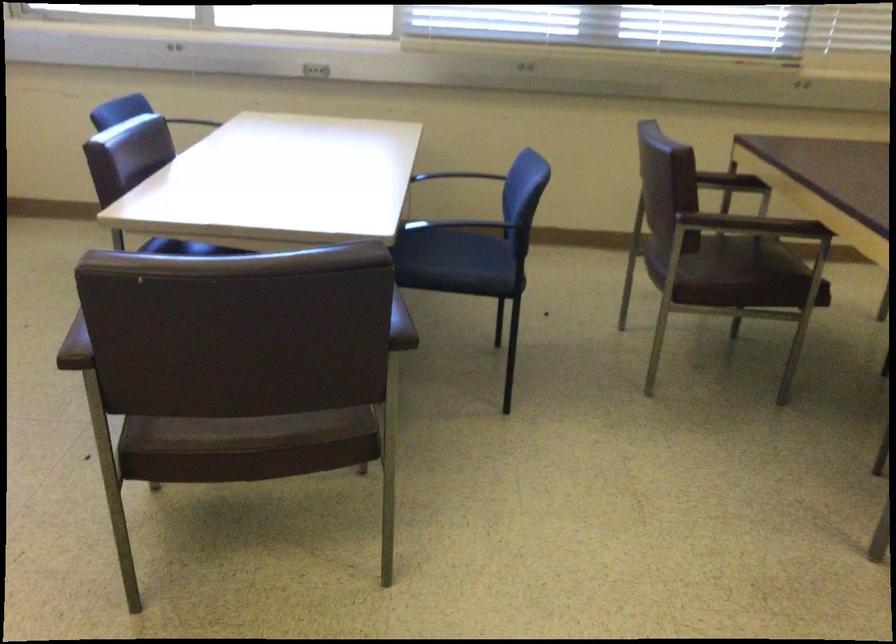
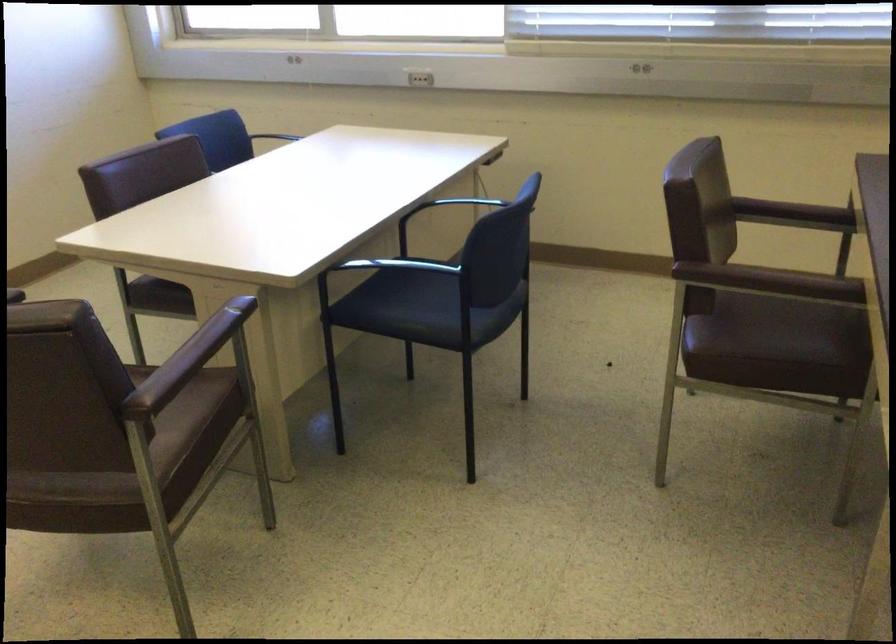
Question: The images are taken continuously from a first-person perspective. In which direction is your viewpoint rotating?

Choices:
 (A) Left
 (B) Right
 (C) Up
 (D) Down

Answer: (A)